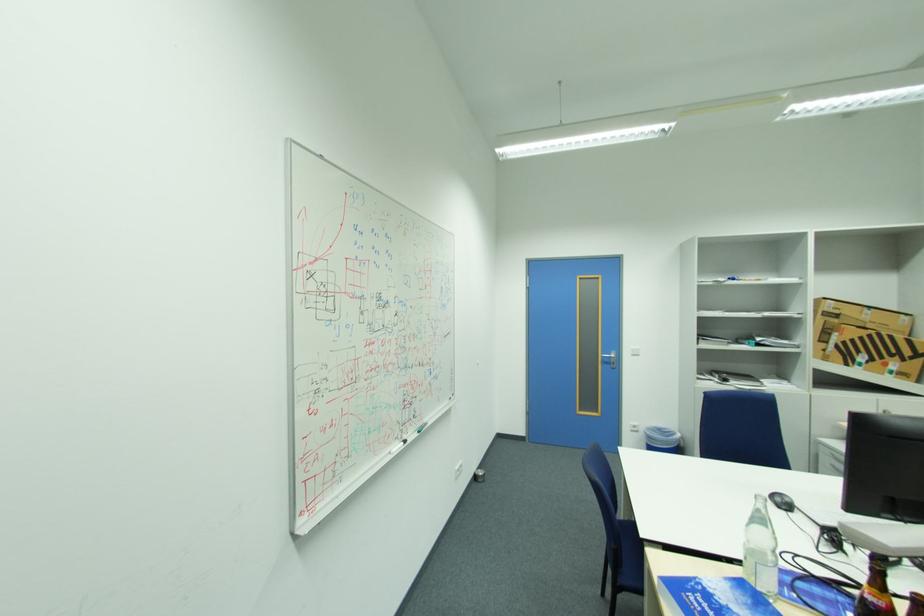
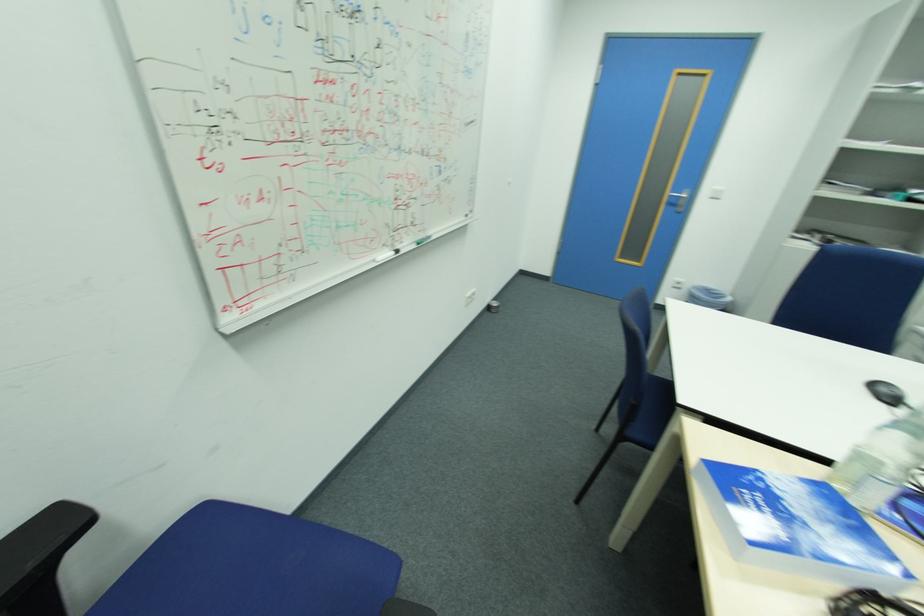
In the second image, find the point that corresponds to point 612,362 in the first image.

(678, 203)